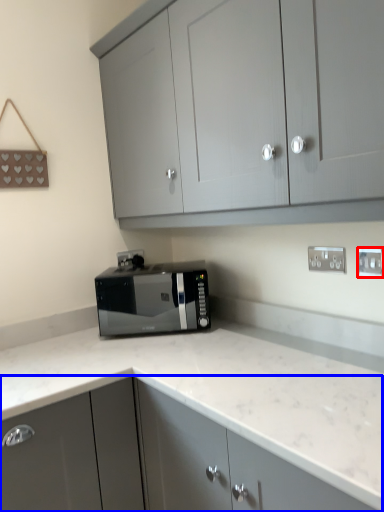
Question: Which of the following is the closest to the observer, electric outlet (highlighted by a red box) or cabinetry (highlighted by a blue box)?

Choices:
 (A) electric outlet
 (B) cabinetry

Answer: (B)